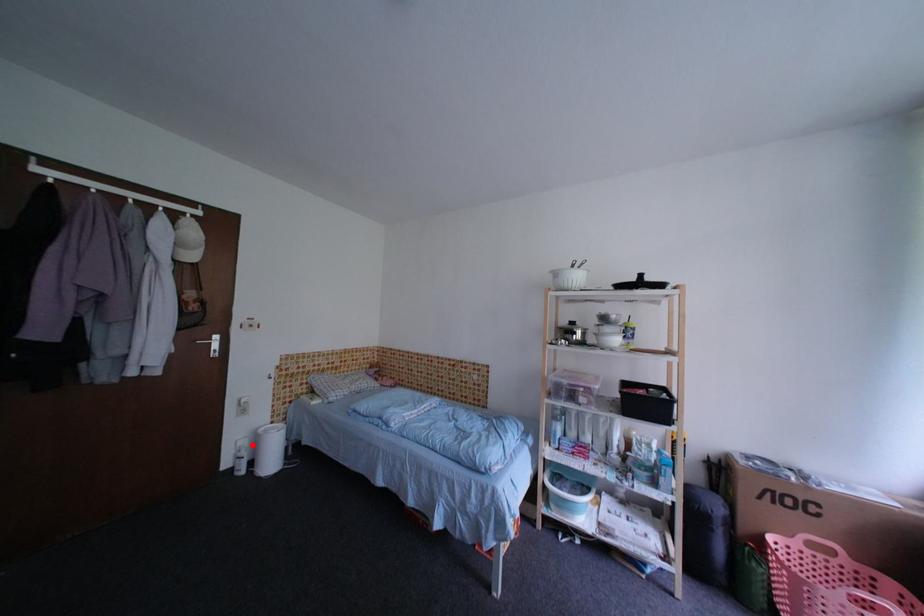
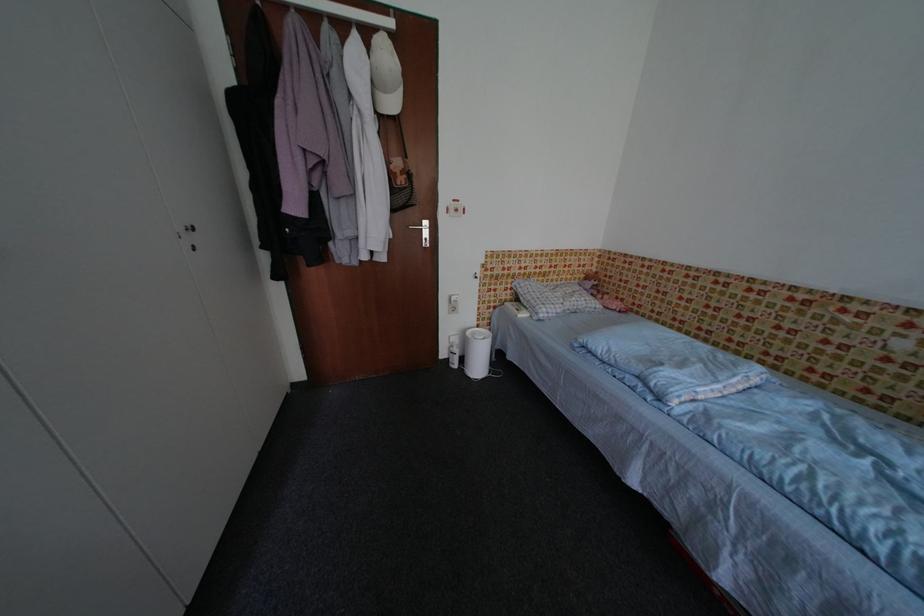
The point at the highlighted location is marked in the first image. Where is the corresponding point in the second image?

(464, 342)